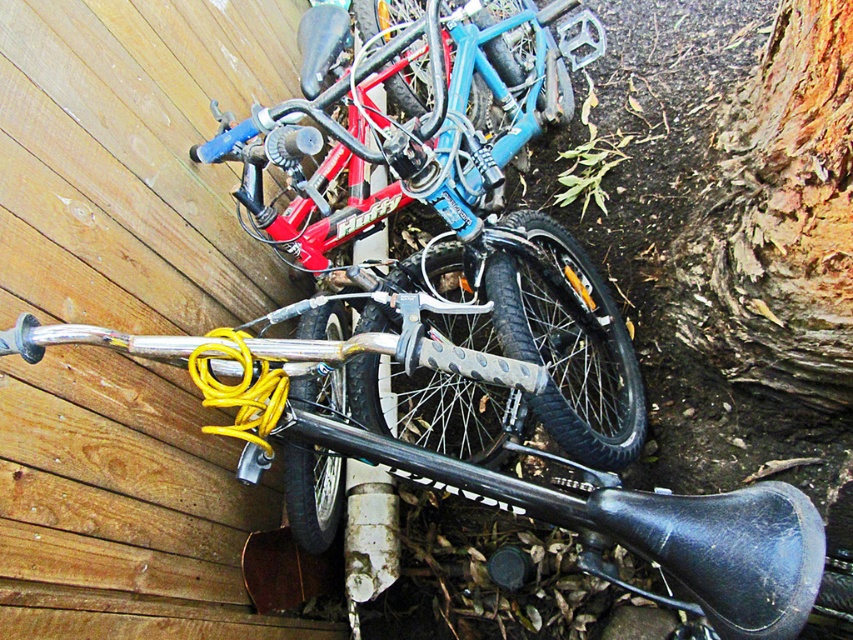
Is point (289, 502) less distant than point (759, 337)?

Yes, it is.

Describe the element at coordinates (453, 209) in the screenshot. This screenshot has width=853, height=640. I see `matte blue bicycle at center` at that location.

Which is behind, point (560, 349) or point (735, 218)?

Positioned behind is point (560, 349).

Where is `matte blue bicycle at center`? The width and height of the screenshot is (853, 640). matte blue bicycle at center is located at coordinates (453, 209).